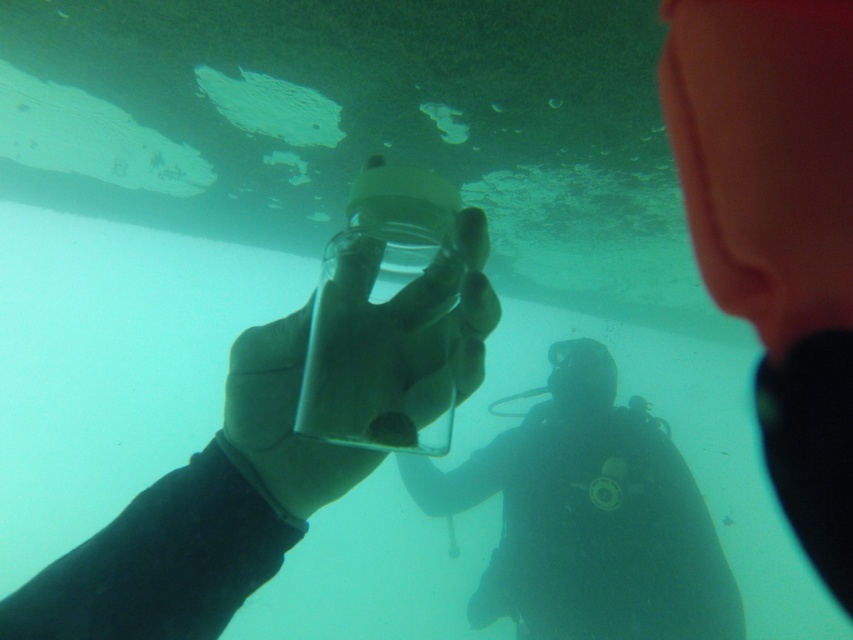
Question: Does black scuba suit at center appear on the right side of transparent glass jar at center?

Choices:
 (A) yes
 (B) no

Answer: (A)

Question: Among these points, which one is nearest to the camera?

Choices:
 (A) (456, 384)
 (B) (593, 464)

Answer: (A)

Question: Can you confirm if black scuba suit at center is positioned to the right of transparent glass jar at center?

Choices:
 (A) yes
 (B) no

Answer: (A)

Question: Which point is closer to the camera?

Choices:
 (A) (367, 234)
 (B) (639, 538)

Answer: (A)

Question: Which point appears farthest from the camera in this image?

Choices:
 (A) (496, 556)
 (B) (415, 451)

Answer: (A)

Question: Observing the image, what is the correct spatial positioning of black scuba suit at center in reference to transparent glass jar at center?

Choices:
 (A) above
 (B) below

Answer: (B)